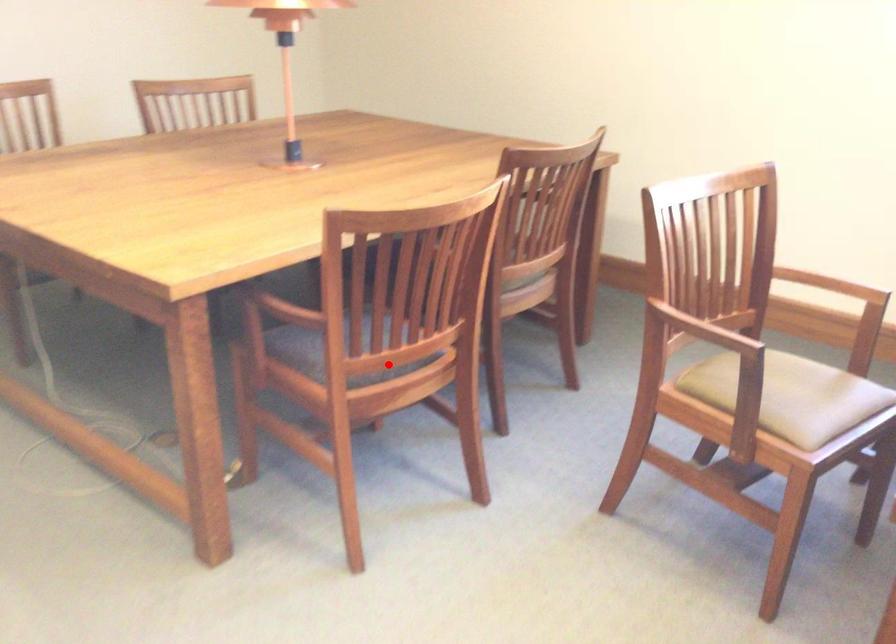
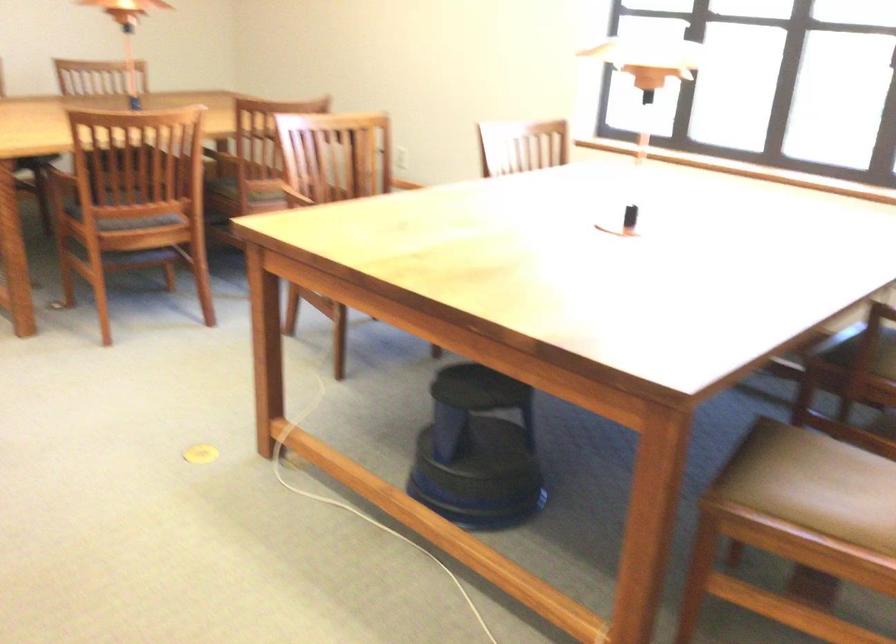
Question: I am providing you with two images of the same scene from different viewpoints. Given a red point in image1, look at the same physical point in image2. Is it:

Choices:
 (A) Closer to the viewpoint
 (B) Farther from the viewpoint

Answer: (B)